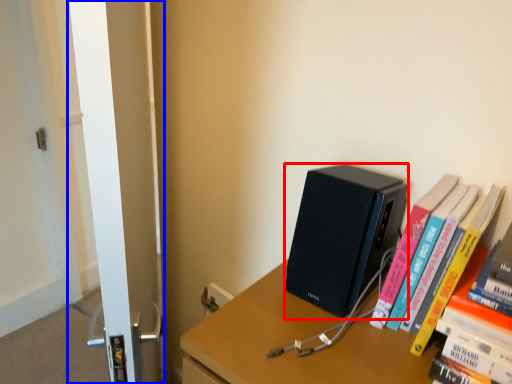
Question: Which object is closer to the camera taking this photo, computer (highlighted by a red box) or screen door (highlighted by a blue box)?

Choices:
 (A) computer
 (B) screen door

Answer: (B)